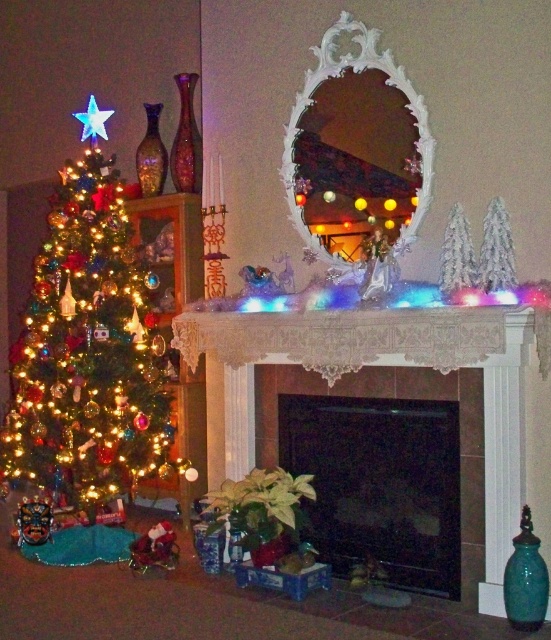
Question: Based on their relative distances, which object is farther from the white lace mantel at upper center?

Choices:
 (A) white ornate mirror at center
 (B) white lace fireplace at center

Answer: (A)

Question: Where is black glass fireplace at center located in relation to white ornate mirror at center in the image?

Choices:
 (A) below
 (B) above

Answer: (A)

Question: Which of these objects is positioned closest to the white lace mantel at upper center?

Choices:
 (A) white ornate mirror at center
 (B) white lace fireplace at center
 (C) black glass fireplace at center

Answer: (B)

Question: Is white lace fireplace at center positioned at the back of black glass fireplace at center?

Choices:
 (A) yes
 (B) no

Answer: (B)

Question: Is black glass fireplace at center below white ornate mirror at center?

Choices:
 (A) no
 (B) yes

Answer: (B)

Question: Which point appears farthest from the camera in this image?

Choices:
 (A) (79, 396)
 (B) (215, 317)
 (C) (407, 515)

Answer: (A)